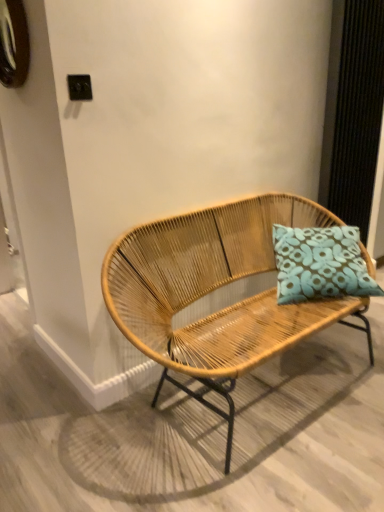
Question: Is brushed metal clock at upper left touching natural wood bench at center?

Choices:
 (A) yes
 (B) no

Answer: (B)

Question: Is brushed metal clock at upper left positioned with its back to natural wood bench at center?

Choices:
 (A) no
 (B) yes

Answer: (A)

Question: From a real-world perspective, is brushed metal clock at upper left over natural wood bench at center?

Choices:
 (A) yes
 (B) no

Answer: (A)

Question: Can you confirm if brushed metal clock at upper left is thinner than natural wood bench at center?

Choices:
 (A) no
 (B) yes

Answer: (B)

Question: Is brushed metal clock at upper left not near natural wood bench at center?

Choices:
 (A) yes
 (B) no

Answer: (A)

Question: From a real-world perspective, is natural wood bench at center physically located above or below teal fabric pillow at center?

Choices:
 (A) above
 (B) below

Answer: (B)

Question: Choose the correct answer: Is natural wood bench at center inside teal fabric pillow at center or outside it?

Choices:
 (A) inside
 (B) outside

Answer: (B)

Question: Is natural wood bench at center in front of or behind teal fabric pillow at center in the image?

Choices:
 (A) front
 (B) behind

Answer: (A)

Question: In the image, is natural wood bench at center on the left side or the right side of teal fabric pillow at center?

Choices:
 (A) left
 (B) right

Answer: (A)

Question: Would you say brushed metal clock at upper left is to the left or to the right of teal fabric pillow at center in the picture?

Choices:
 (A) left
 (B) right

Answer: (A)

Question: Relative to teal fabric pillow at center, is brushed metal clock at upper left in front or behind?

Choices:
 (A) behind
 (B) front

Answer: (B)

Question: Considering the positions of brushed metal clock at upper left and teal fabric pillow at center in the image, is brushed metal clock at upper left bigger or smaller than teal fabric pillow at center?

Choices:
 (A) big
 (B) small

Answer: (B)

Question: From a real-world perspective, relative to teal fabric pillow at center, is brushed metal clock at upper left vertically above or below?

Choices:
 (A) below
 (B) above

Answer: (B)

Question: From the image's perspective, is natural wood bench at center positioned above or below brushed metal clock at upper left?

Choices:
 (A) above
 (B) below

Answer: (B)

Question: From a real-world perspective, is natural wood bench at center above or below brushed metal clock at upper left?

Choices:
 (A) above
 (B) below

Answer: (B)